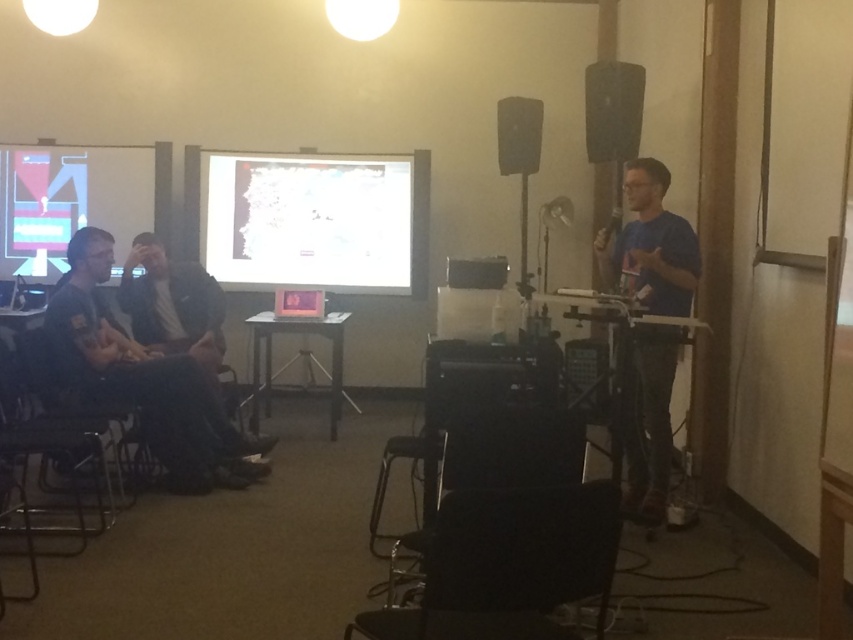
Question: Is the position of white matte projection screen at center more distant than that of dark blue jeans at left?

Choices:
 (A) no
 (B) yes

Answer: (B)

Question: Estimate the real-world distances between objects in this image. Which object is farther from the white matte projection screen at center?

Choices:
 (A) black matte speaker at upper right
 (B) dark blue jeans at left
 (C) blue cotton shirt at right
 (D) matte plastic projection screen at upper left

Answer: (C)

Question: Can you confirm if dark blue jeans at left is positioned below matte plastic projection screen at upper left?

Choices:
 (A) yes
 (B) no

Answer: (A)

Question: Which point is closer to the camera taking this photo?

Choices:
 (A) (310, 193)
 (B) (175, 396)
 (C) (535, 99)

Answer: (B)

Question: Which of the following is the farthest from the observer?

Choices:
 (A) (648, 337)
 (B) (300, 193)
 (C) (222, 410)
 (D) (639, 113)

Answer: (B)

Question: In this image, where is blue cotton shirt at right located relative to matte plastic projection screen at upper left?

Choices:
 (A) below
 (B) above

Answer: (A)